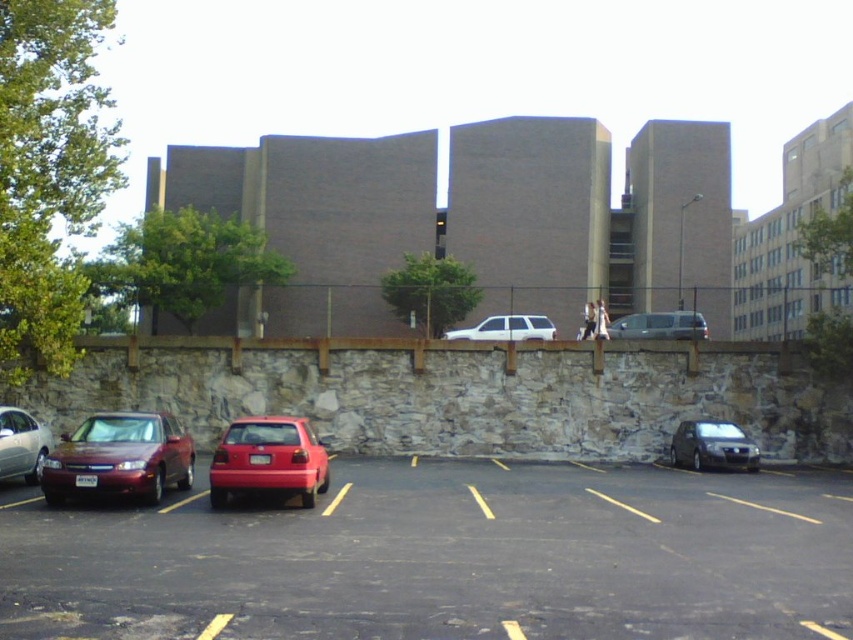
This screenshot has width=853, height=640. What are the coordinates of `shiny silver sedan at left` in the screenshot? It's located at (21, 444).

Is shiny silver sedan at left smaller than satin silver van at center-right?

Yes.

Does point (7, 467) come closer to viewer compared to point (662, 316)?

Yes, point (7, 467) is in front of point (662, 316).

Locate an element on the screen. shiny silver sedan at left is located at coordinates (21, 444).

Can you confirm if satin silver van at center-right is bigger than white matte suv at center?

Indeed, satin silver van at center-right has a larger size compared to white matte suv at center.

I want to click on satin silver van at center-right, so click(659, 324).

Between smooth asphalt parking lot at lower center and shiny red sedan at left, which one appears on the left side from the viewer's perspective?

shiny red sedan at left is more to the left.

Does smooth asphalt parking lot at lower center have a lesser height compared to shiny red sedan at left?

Incorrect, smooth asphalt parking lot at lower center's height does not fall short of shiny red sedan at left's.

Describe the element at coordinates (445, 557) in the screenshot. The height and width of the screenshot is (640, 853). I see `smooth asphalt parking lot at lower center` at that location.

The image size is (853, 640). I want to click on smooth asphalt parking lot at lower center, so click(445, 557).